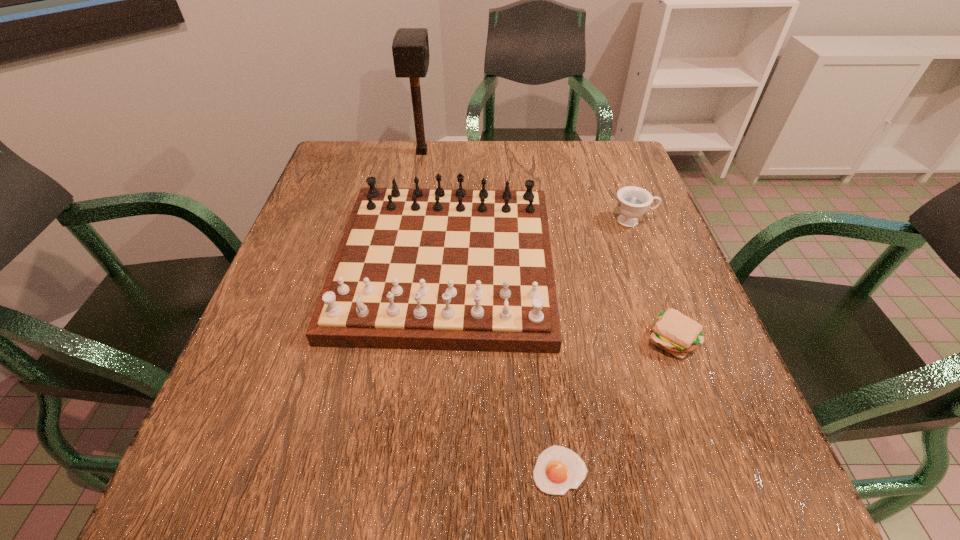
You are a GUI agent. You are given a task and a screenshot of the screen. Output one action in this format:
    pyautogui.click(x=<x>, y=<y>)
    Task: Click on the vacant point located on the back of the egg yolk
    
    Given the screenshot: What is the action you would take?
    pyautogui.click(x=546, y=357)

Image resolution: width=960 pixels, height=540 pixels. I want to click on object located at the far edge, so click(x=410, y=47).

The width and height of the screenshot is (960, 540). Find the location of `object that is positioned at the near edge`. object that is positioned at the near edge is located at coordinates (558, 469).

At what (x,y) coordinates should I click in order to perform the action: click on object that is at the left edge. Please return your answer as a coordinate pair (x, y). Looking at the image, I should click on (460, 269).

In order to click on teacup present at the right edge in this screenshot , I will do `click(633, 201)`.

The height and width of the screenshot is (540, 960). Identify the location of patty present at the right edge. (x=673, y=332).

This screenshot has height=540, width=960. I want to click on vacant region at the far edge of the desktop, so click(x=406, y=159).

Where is `vacant region at the near edge of the desktop`? vacant region at the near edge of the desktop is located at coordinates (598, 483).

Image resolution: width=960 pixels, height=540 pixels. In the image, there is a desktop. Identify the location of vacant space at the left edge. (269, 299).

The height and width of the screenshot is (540, 960). I want to click on free space at the right edge of the desktop, so click(681, 281).